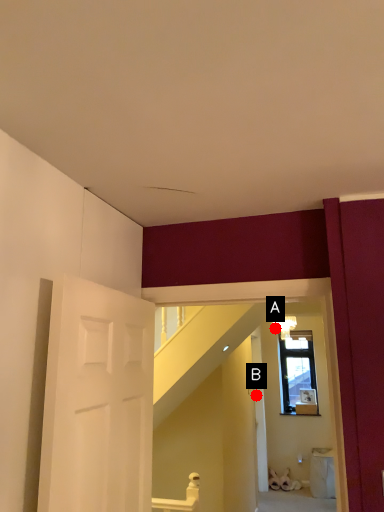
Question: Two points are circled on the image, labeled by A and B beside each circle. Which point is closer to the camera taking this photo?

Choices:
 (A) A is closer
 (B) B is closer

Answer: (B)